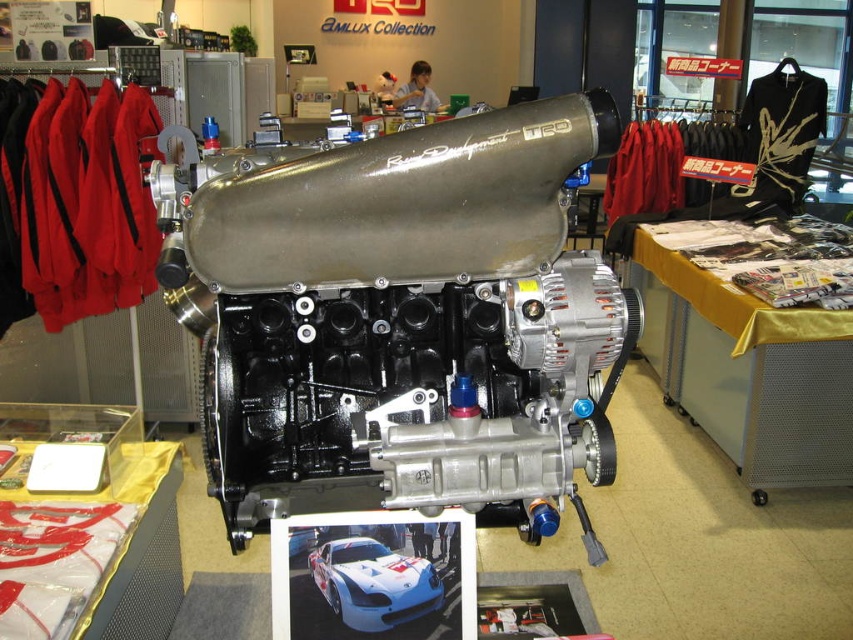
Question: Which point appears closest to the camera in this image?

Choices:
 (A) (422, 134)
 (B) (346, 614)

Answer: (A)

Question: Which point is farther from the camera taking this photo?

Choices:
 (A) (370, 602)
 (B) (550, 365)

Answer: (A)

Question: Is silver metallic engine at center further to the viewer compared to white glossy car at center?

Choices:
 (A) no
 (B) yes

Answer: (A)

Question: Can you confirm if silver metallic engine at center is positioned to the left of white glossy car at center?

Choices:
 (A) no
 (B) yes

Answer: (A)

Question: Does silver metallic engine at center appear on the left side of white glossy car at center?

Choices:
 (A) yes
 (B) no

Answer: (B)